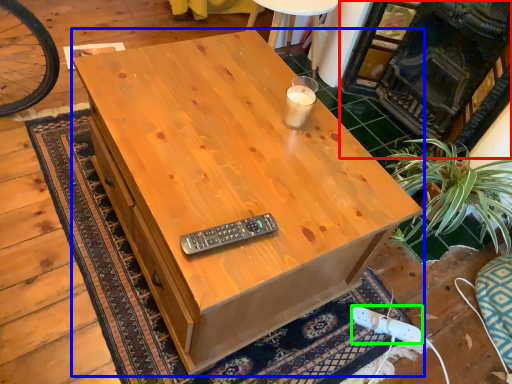
Question: Which is nearer to the fireplace (highlighted by a red box)? desk (highlighted by a blue box) or plug (highlighted by a green box).

Choices:
 (A) desk
 (B) plug

Answer: (A)